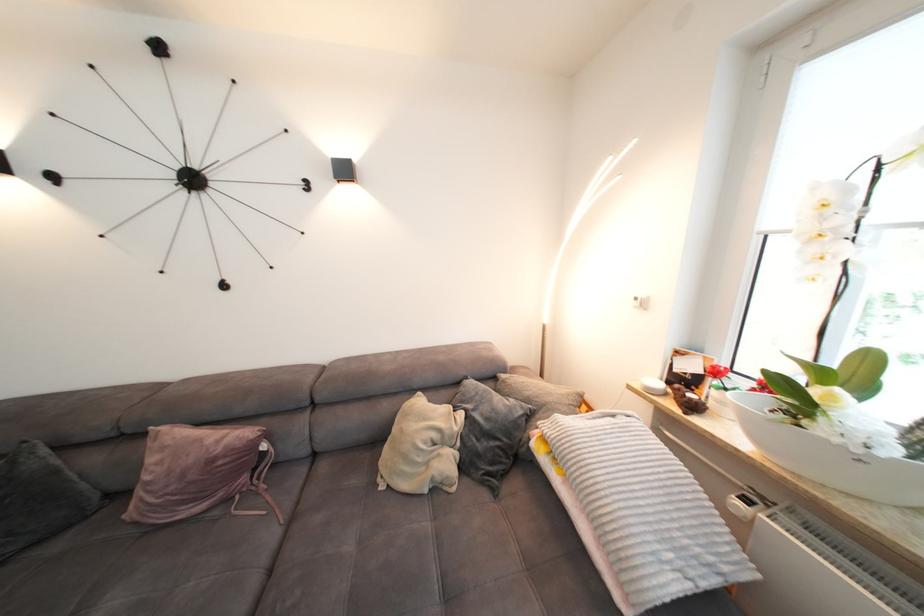
The width and height of the screenshot is (924, 616). What do you see at coordinates (640, 302) in the screenshot?
I see `the white wall switch` at bounding box center [640, 302].